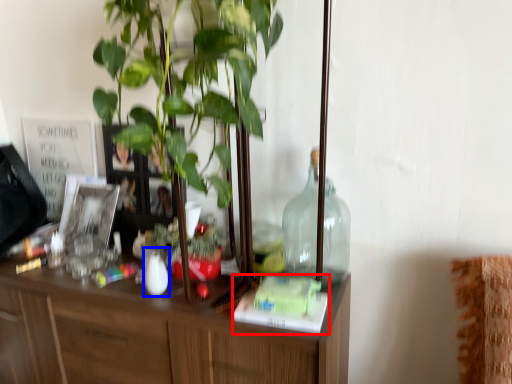
Question: Which of the following is the closest to the observer, book (highlighted by a red box) or vase (highlighted by a blue box)?

Choices:
 (A) book
 (B) vase

Answer: (A)